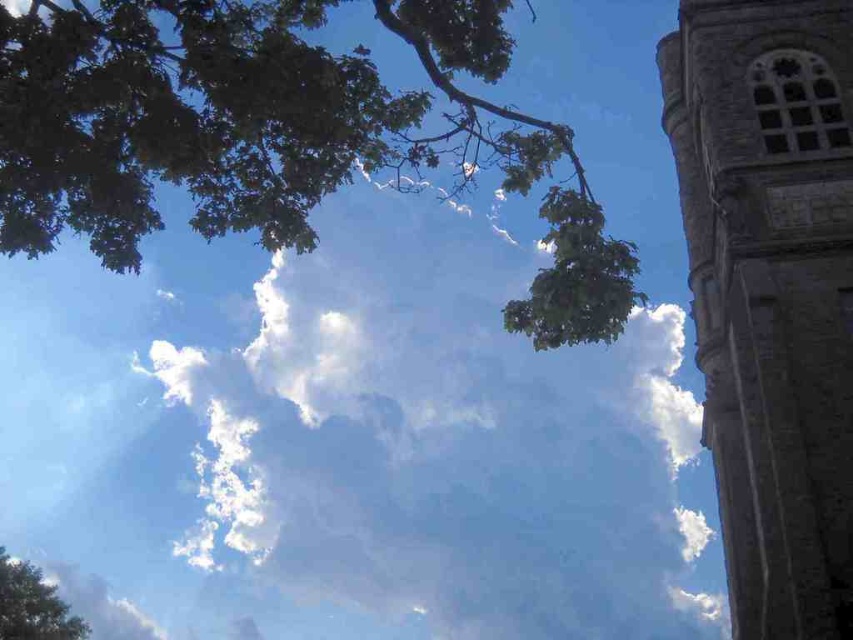
You are an architect analyzing this scene. You need to determine which structure occupies more vertical space in the image. Based on the scene, which one is taller between the stone tower at right and the green leafy tree at lower left?

The stone tower at right is much taller than the green leafy tree at lower left according to the description.

You are standing at the base of the stone tower at right and want to place a 2.5 meter tall statue in front of it. Can the statue be seen in its entirety from your current position?

The stone tower at right is 18.87 meters away from the viewer. Since the statue is only 2.5 meters tall, it will not block the entire view of the tower. Therefore, the statue can be seen in its entirety from your current position.